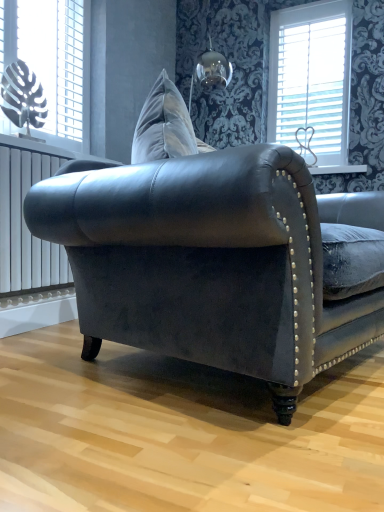
What do you see at coordinates (203, 256) in the screenshot?
I see `velvet dark gray couch at center` at bounding box center [203, 256].

Describe the element at coordinates (25, 223) in the screenshot. I see `white metallic radiator at left` at that location.

What do you see at coordinates (55, 62) in the screenshot? I see `white plastic monstera leaf at upper left, the 1th window in the left-to-right sequence` at bounding box center [55, 62].

This screenshot has width=384, height=512. Identify the location of velvet dark gray couch at center. (203, 256).

Could you tell me if white metallic radiator at left is turned towards white plastic monstera leaf at upper left, which is counted as the second window, starting from the back?

No, white metallic radiator at left does not turn towards white plastic monstera leaf at upper left, which is counted as the second window, starting from the back.

In terms of height, does white metallic radiator at left look taller or shorter compared to white plastic monstera leaf at upper left, which is counted as the second window, starting from the back?

white metallic radiator at left is shorter than white plastic monstera leaf at upper left, which is counted as the second window, starting from the back.

From a real-world perspective, which is physically above, white metallic radiator at left or white plastic monstera leaf at upper left, the 1th window in the left-to-right sequence?

white plastic monstera leaf at upper left, the 1th window in the left-to-right sequence, from a real-world perspective.

Is white metallic radiator at left positioned behind white plastic monstera leaf at upper left, which appears as the first window when viewed from the front?

No, it is not.

Would you say white metallic radiator at left is to the left or to the right of white glossy window sill at upper center in the picture?

In the image, white metallic radiator at left appears on the left side of white glossy window sill at upper center.

Which of these two, white metallic radiator at left or white glossy window sill at upper center, stands taller?

With more height is white metallic radiator at left.

The width and height of the screenshot is (384, 512). In order to click on radiator that is on the left side of white glossy window sill at upper center in this screenshot , I will do (x=25, y=223).

Is white metallic radiator at left further to the viewer compared to white glossy window sill at upper center?

No, it is not.

Can you confirm if white glossy window sill at upper center is positioned to the right of white wooden blinds at upper right, the 1th window in the right-to-left sequence?

Indeed, white glossy window sill at upper center is positioned on the right side of white wooden blinds at upper right, the 1th window in the right-to-left sequence.

Considering the points (319, 167) and (337, 82), which point is in front, point (319, 167) or point (337, 82)?

The point (319, 167) is closer to the camera.

Is white glossy window sill at upper center positioned with its back to white wooden blinds at upper right, the 1th window in the right-to-left sequence?

No, white glossy window sill at upper center is not facing away from white wooden blinds at upper right, the 1th window in the right-to-left sequence.

From a real-world perspective, which is physically below, white metallic radiator at left or velvet dark gray couch at center?

In real-world perspective, velvet dark gray couch at center is lower.

Which object is positioned more to the right, white metallic radiator at left or velvet dark gray couch at center?

From the viewer's perspective, velvet dark gray couch at center appears more on the right side.

Considering the relative sizes of white metallic radiator at left and velvet dark gray couch at center in the image provided, is white metallic radiator at left shorter than velvet dark gray couch at center?

Yes, white metallic radiator at left is shorter than velvet dark gray couch at center.

Are white wooden blinds at upper right, marked as the first window in a back-to-front arrangement, and white glossy window sill at upper center beside each other?

No.

From a real-world perspective, is white wooden blinds at upper right, which is the 2th window from front to back, beneath white glossy window sill at upper center?

Actually, white wooden blinds at upper right, which is the 2th window from front to back, is physically above white glossy window sill at upper center in the real world.

Which object is positioned more to the right, white wooden blinds at upper right, the 1th window in the right-to-left sequence, or velvet dark gray couch at center?

From the viewer's perspective, white wooden blinds at upper right, the 1th window in the right-to-left sequence, appears more on the right side.

Considering the sizes of white wooden blinds at upper right, which is counted as the second window, starting from the left, and velvet dark gray couch at center in the image, is white wooden blinds at upper right, which is counted as the second window, starting from the left, taller or shorter than velvet dark gray couch at center?

Clearly, white wooden blinds at upper right, which is counted as the second window, starting from the left, is taller compared to velvet dark gray couch at center.

Looking at this image, is white wooden blinds at upper right, the 1th window in the right-to-left sequence, not close to velvet dark gray couch at center?

Absolutely, white wooden blinds at upper right, the 1th window in the right-to-left sequence, is distant from velvet dark gray couch at center.

Is white wooden blinds at upper right, the 1th window in the right-to-left sequence, oriented towards velvet dark gray couch at center?

Yes, white wooden blinds at upper right, the 1th window in the right-to-left sequence, is facing velvet dark gray couch at center.

Can you confirm if velvet dark gray couch at center is wider than white wooden blinds at upper right, marked as the first window in a back-to-front arrangement?

Yes.

Can you confirm if velvet dark gray couch at center is bigger than white wooden blinds at upper right, marked as the first window in a back-to-front arrangement?

Indeed, velvet dark gray couch at center has a larger size compared to white wooden blinds at upper right, marked as the first window in a back-to-front arrangement.

In the scene shown: From a real-world perspective, which object stands above the other?

white wooden blinds at upper right, marked as the first window in a back-to-front arrangement, is physically above.

Would you consider velvet dark gray couch at center to be distant from white wooden blinds at upper right, which is counted as the second window, starting from the left?

That's right, there is a large distance between velvet dark gray couch at center and white wooden blinds at upper right, which is counted as the second window, starting from the left.

Identify the location of radiator that is below the white plastic monstera leaf at upper left, the 1th window in the left-to-right sequence (from the image's perspective). The height and width of the screenshot is (512, 384). (25, 223).

This screenshot has width=384, height=512. Find the location of `window sill above the white metallic radiator at left (from a real-world perspective)`. window sill above the white metallic radiator at left (from a real-world perspective) is located at coordinates (337, 169).

Estimate the real-world distances between objects in this image. Which object is further from white glossy window sill at upper center, velvet dark gray couch at center or white plastic monstera leaf at upper left, which appears as the first window when viewed from the front?

velvet dark gray couch at center lies further to white glossy window sill at upper center than the other object.

Based on their spatial positions, is white glossy window sill at upper center or white metallic radiator at left closer to velvet dark gray couch at center?

Among the two, white metallic radiator at left is located nearer to velvet dark gray couch at center.

From the image, which object appears to be nearer to white glossy window sill at upper center, white metallic radiator at left or white wooden blinds at upper right, the 1th window in the right-to-left sequence?

Among the two, white wooden blinds at upper right, the 1th window in the right-to-left sequence, is located nearer to white glossy window sill at upper center.

Considering their positions, is white metallic radiator at left positioned closer to white glossy window sill at upper center than velvet dark gray couch at center?

Based on the image, white metallic radiator at left appears to be nearer to white glossy window sill at upper center.

Which object lies nearer to the anchor point white metallic radiator at left, white wooden blinds at upper right, the 1th window in the right-to-left sequence, or velvet dark gray couch at center?

velvet dark gray couch at center lies closer to white metallic radiator at left than the other object.

When comparing their distances from white glossy window sill at upper center, does white plastic monstera leaf at upper left, which appears as the first window when viewed from the front, or velvet dark gray couch at center seem further?

velvet dark gray couch at center is positioned further to the anchor white glossy window sill at upper center.

Considering their positions, is white wooden blinds at upper right, marked as the first window in a back-to-front arrangement, positioned closer to white metallic radiator at left than white plastic monstera leaf at upper left, which is the second window in right-to-left order?

white plastic monstera leaf at upper left, which is the second window in right-to-left order, is positioned closer to the anchor white metallic radiator at left.

Which object lies nearer to the anchor point white plastic monstera leaf at upper left, which is the second window in right-to-left order, white metallic radiator at left or white wooden blinds at upper right, which is the 2th window from front to back?

The object closer to white plastic monstera leaf at upper left, which is the second window in right-to-left order, is white metallic radiator at left.

Where is `radiator located between velvet dark gray couch at center and white wooden blinds at upper right, which is the 2th window from front to back, in the depth direction`? The height and width of the screenshot is (512, 384). radiator located between velvet dark gray couch at center and white wooden blinds at upper right, which is the 2th window from front to back, in the depth direction is located at coordinates (25, 223).

Identify the location of radiator between white plastic monstera leaf at upper left, which is counted as the second window, starting from the back, and white wooden blinds at upper right, the 1th window in the right-to-left sequence, from left to right. The height and width of the screenshot is (512, 384). (25, 223).

The image size is (384, 512). I want to click on window between white metallic radiator at left and white glossy window sill at upper center in the horizontal direction, so click(311, 78).

What are the coordinates of `window located between velvet dark gray couch at center and white wooden blinds at upper right, the 1th window in the right-to-left sequence, in the depth direction` in the screenshot? It's located at (55, 62).